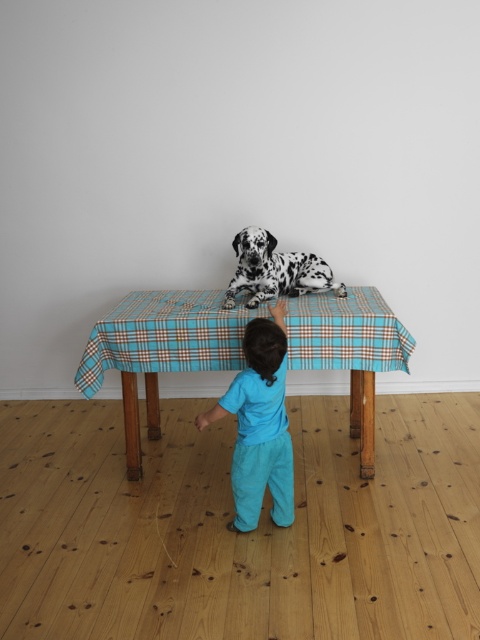
You are a photographer setting up a shoot in the room. You want to position a small stool between the turquoise cotton pants at center and the spotted fur dog at center. Since the pants are to the left of the dog, where should you place the stool?

The turquoise cotton pants at center is to the left of the spotted fur dog at center, so you should place the stool between them to the right of the pants and to the left of the dog.

You are a photographer setting up for a photo shoot. You need to ensure that the turquoise cotton pants at center and the blue plaid tablecloth at center are both visible in the frame. Based on their positions, which object is closer to the camera?

The blue plaid tablecloth at center is closer to the camera because the turquoise cotton pants at center is behind it.

You are a photographer trying to capture a photo of the spotted fur dog at center without the turquoise cotton pants at center appearing in the frame. Is this possible given their positions?

The turquoise cotton pants at center is below the spotted fur dog at center, so the dog is on top of the pants. Since the pants are underneath the dog, they would not be visible in the frame if the dog is positioned over them. Therefore, it is possible to take a photo of the spotted fur dog at center without the turquoise cotton pants at center showing in the frame.